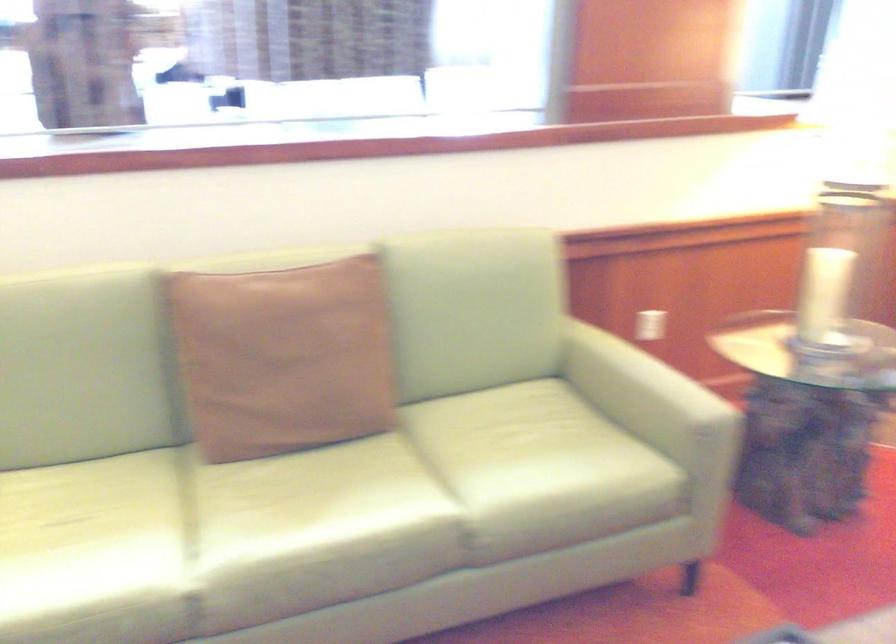
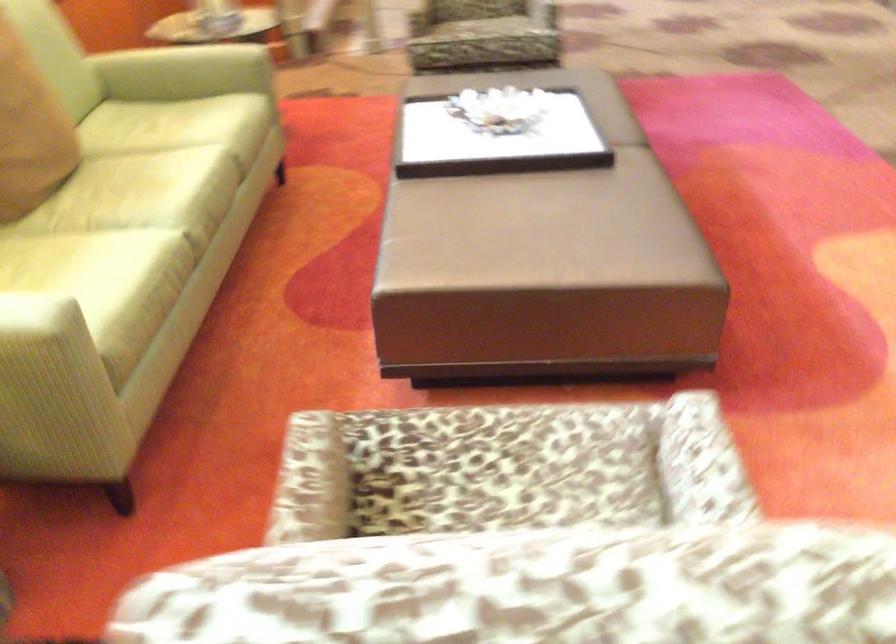
In the second image, find the point that corresponds to (x=494, y=462) in the first image.

(177, 126)